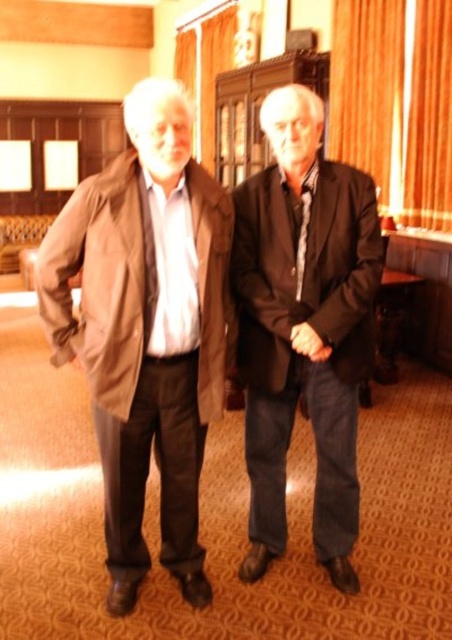
Question: Can you confirm if brown leather jacket at center is positioned to the left of dark brown leather jacket at center?

Choices:
 (A) yes
 (B) no

Answer: (A)

Question: Is brown leather jacket at center positioned behind dark brown leather jacket at center?

Choices:
 (A) no
 (B) yes

Answer: (A)

Question: Is brown leather jacket at center smaller than dark brown leather jacket at center?

Choices:
 (A) yes
 (B) no

Answer: (B)

Question: Among these points, which one is farthest from the camera?

Choices:
 (A) (295, 248)
 (B) (142, 198)

Answer: (A)

Question: Among these objects, which one is nearest to the camera?

Choices:
 (A) dark brown leather jacket at center
 (B) brown leather jacket at center

Answer: (B)